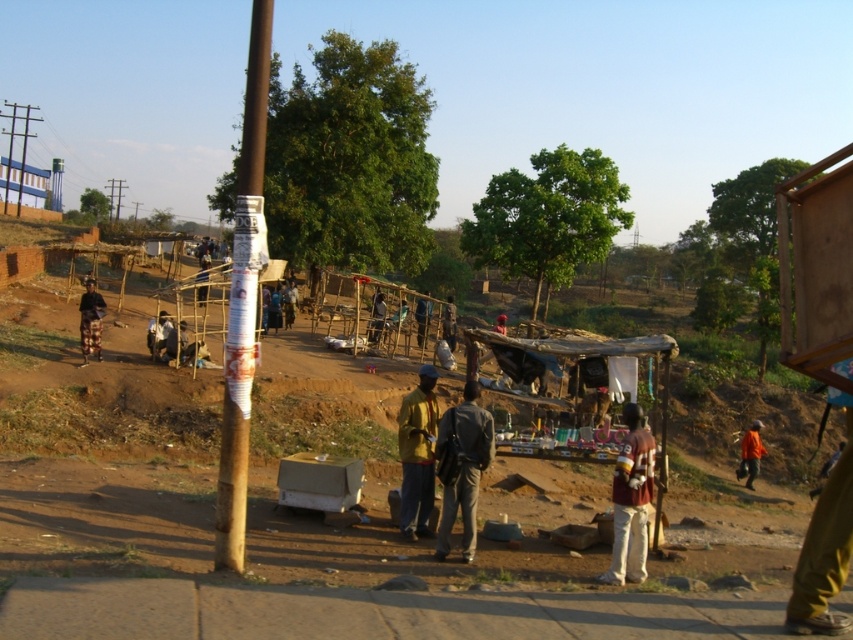
The width and height of the screenshot is (853, 640). I want to click on dark brown fabric pants at left, so (x=90, y=321).

How distant is dark brown fabric pants at left from dark brown leather jacket at center?

A distance of 11.28 meters exists between dark brown fabric pants at left and dark brown leather jacket at center.

This screenshot has height=640, width=853. I want to click on dark brown fabric pants at left, so click(90, 321).

Who is more distant from viewer, (256, 61) or (624, 564)?

The point (624, 564) is behind.

Can you confirm if rusty metal pole at center is smaller than maroon fabric shirt at center?

No.

What do you see at coordinates (242, 301) in the screenshot?
I see `rusty metal pole at center` at bounding box center [242, 301].

In order to click on rusty metal pole at center in this screenshot , I will do `click(242, 301)`.

Between dark gray jacket at center and dark brown fabric pants at left, which one has more height?

Standing taller between the two is dark gray jacket at center.

Between dark gray jacket at center and dark brown fabric pants at left, which one is positioned higher?

dark brown fabric pants at left is higher up.

Where is `dark gray jacket at center`? The width and height of the screenshot is (853, 640). dark gray jacket at center is located at coordinates (462, 467).

You are a GUI agent. You are given a task and a screenshot of the screen. Output one action in this format:
    pyautogui.click(x=<x>, y=<y>)
    Task: Click on the dark gray jacket at center
    
    Given the screenshot: What is the action you would take?
    click(462, 467)